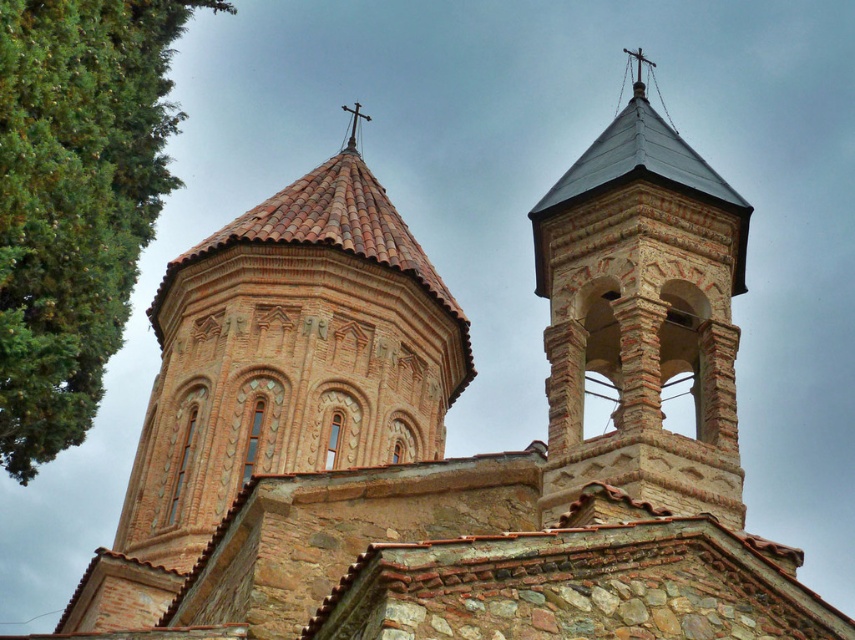
Question: Which point is closer to the camera?

Choices:
 (A) (68, 355)
 (B) (579, 280)

Answer: (A)

Question: Among these objects, which one is farthest from the camera?

Choices:
 (A) brown stone bell tower at upper right
 (B) green leafy tree at left

Answer: (A)

Question: Can you confirm if green leafy tree at left is bigger than brown stone bell tower at upper right?

Choices:
 (A) yes
 (B) no

Answer: (A)

Question: Can you confirm if green leafy tree at left is positioned to the right of brown stone bell tower at upper right?

Choices:
 (A) yes
 (B) no

Answer: (B)

Question: Is green leafy tree at left further to the viewer compared to brown stone bell tower at upper right?

Choices:
 (A) no
 (B) yes

Answer: (A)

Question: Which object appears farthest from the camera in this image?

Choices:
 (A) green leafy tree at left
 (B) brown stone bell tower at upper right

Answer: (B)